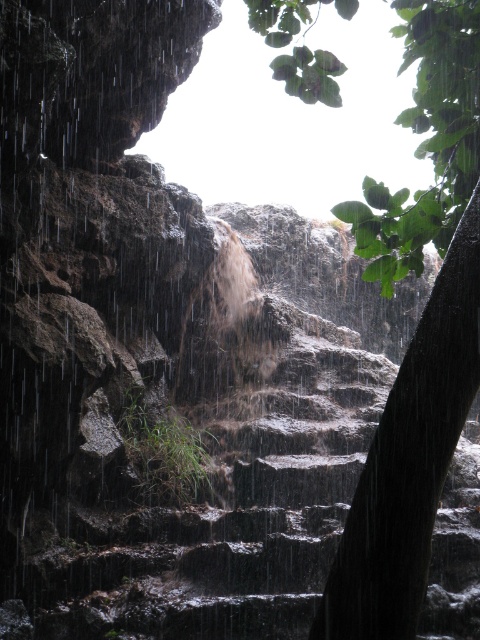
You are a hiker trying to navigate the dark stone stairs at center and the green leafy tree at upper right. Which object is closer to you as you stand at the base of the stairs?

The dark stone stairs at center are closer to you than the green leafy tree at upper right because the stairs are positioned further to the viewer in the image.

Consider the image. You are a hiker trying to navigate the dark stone stairs at center while avoiding the heavy rain. Can you estimate if the green leafy tree at upper right can provide enough shade to shelter you from the rain?

The dark stone stairs at center is bigger than the green leafy tree at upper right, so the tree might not be large enough to provide sufficient shade to shelter you from the rain.